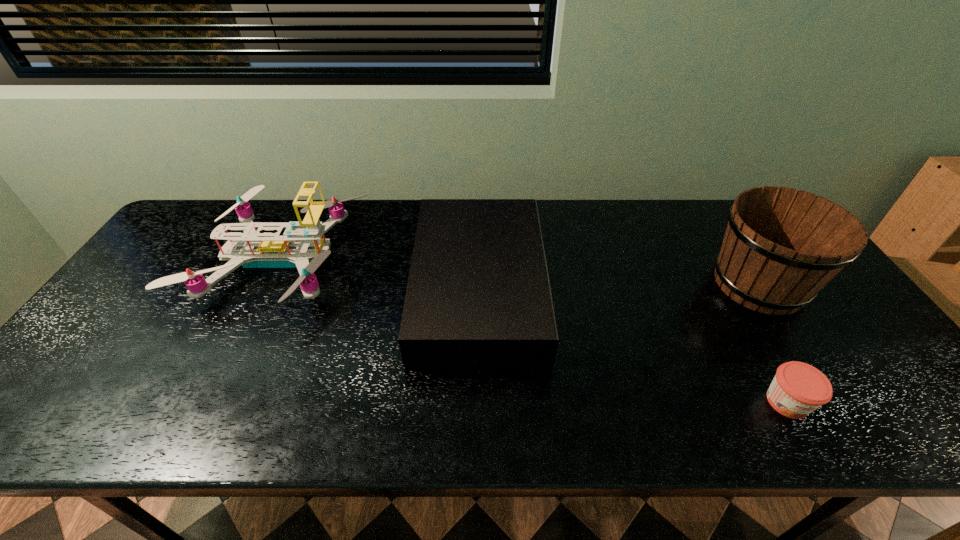
Identify the location of CD player located in the far edge section of the desktop. (478, 294).

At what (x,y) coordinates should I click in order to perform the action: click on object located in the near edge section of the desktop. Please return your answer as a coordinate pair (x, y). This screenshot has height=540, width=960. Looking at the image, I should click on (797, 389).

The image size is (960, 540). In order to click on object present at the left edge in this screenshot , I will do `click(296, 247)`.

Locate an element on the screen. This screenshot has height=540, width=960. object that is at the right edge is located at coordinates (782, 246).

At what (x,y) coordinates should I click in order to perform the action: click on object that is at the far left corner. Please return your answer as a coordinate pair (x, y). Looking at the image, I should click on (296, 247).

I want to click on free space at the far edge of the desktop, so click(x=602, y=209).

In the image, there is a desktop. Identify the location of vacant space at the near edge. The width and height of the screenshot is (960, 540). (668, 415).

The image size is (960, 540). What are the coordinates of `free location at the left edge` in the screenshot? It's located at (109, 340).

The image size is (960, 540). In order to click on vacant area that lies between the wine bucket and the nearest object in this screenshot , I will do `click(773, 343)`.

Identify the location of free space that is in between the shortest object and the wine bucket. This screenshot has height=540, width=960. (773, 343).